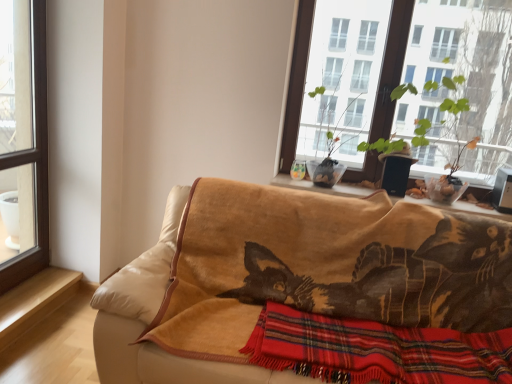
Question: Is transparent glass window at left, the first window from the left, to the right of velvet beige couch at center from the viewer's perspective?

Choices:
 (A) yes
 (B) no

Answer: (B)

Question: Is transparent glass window at left, the first window from the left, positioned behind velvet beige couch at center?

Choices:
 (A) no
 (B) yes

Answer: (B)

Question: From a real-world perspective, is transparent glass window at left, the first window from the left, positioned under velvet beige couch at center based on gravity?

Choices:
 (A) no
 (B) yes

Answer: (A)

Question: Is transparent glass window at left, the first window from the left, oriented towards velvet beige couch at center?

Choices:
 (A) yes
 (B) no

Answer: (A)

Question: Does transparent glass window at left, the first window from the left, have a larger size compared to velvet beige couch at center?

Choices:
 (A) yes
 (B) no

Answer: (B)

Question: Can you confirm if transparent glass window at left, the first window from the left, is wider than velvet beige couch at center?

Choices:
 (A) no
 (B) yes

Answer: (A)

Question: From the image's perspective, does wooden window sill at center, positioned as the first window sill in top-to-bottom order, appear higher than transparent glass window at left, which is counted as the 2th window, starting from the right?

Choices:
 (A) no
 (B) yes

Answer: (A)

Question: Is transparent glass window at left, the first window from the left, located within wooden window sill at center, positioned as the first window sill in top-to-bottom order?

Choices:
 (A) yes
 (B) no

Answer: (B)

Question: Can you confirm if wooden window sill at center, the 2th window sill when ordered from bottom to top, is wider than transparent glass window at left, the first window from the left?

Choices:
 (A) yes
 (B) no

Answer: (A)

Question: Considering the relative positions of wooden window sill at center, positioned as the 1th window sill in right-to-left order, and transparent glass window at left, the first window from the left, in the image provided, is wooden window sill at center, positioned as the 1th window sill in right-to-left order, to the left of transparent glass window at left, the first window from the left, from the viewer's perspective?

Choices:
 (A) no
 (B) yes

Answer: (A)

Question: Is wooden window sill at center, positioned as the first window sill in top-to-bottom order, facing away from transparent glass window at left, which is counted as the 2th window, starting from the right?

Choices:
 (A) no
 (B) yes

Answer: (A)

Question: Could you tell me if wooden window sill at center, the 2th window sill in the left-to-right sequence, is facing transparent glass window at left, which is counted as the 2th window, starting from the right?

Choices:
 (A) yes
 (B) no

Answer: (B)

Question: Is transparent glass window at left, which is counted as the 2th window, starting from the right, not near light brown wood at lower left, the 2th window sill positioned from the right?

Choices:
 (A) yes
 (B) no

Answer: (B)